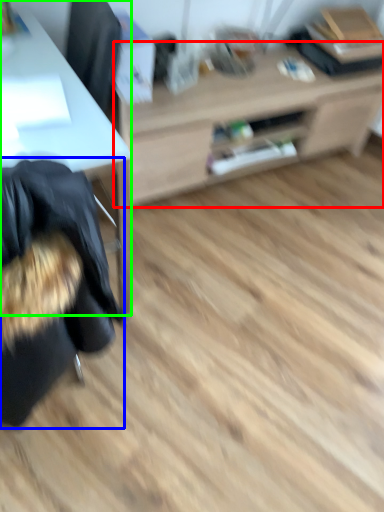
Question: Based on their relative distances, which object is nearer to table (highlighted by a red box)? Choose from bean bag chair (highlighted by a blue box) and desk (highlighted by a green box).

Choices:
 (A) bean bag chair
 (B) desk

Answer: (B)